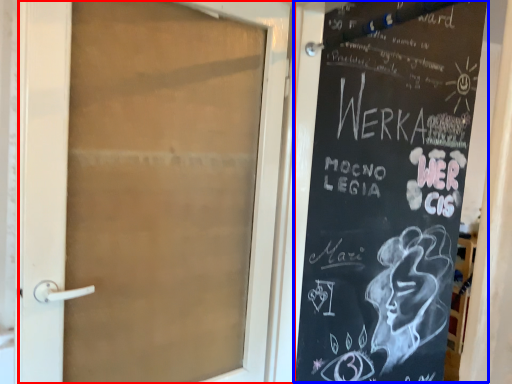
Question: Which point is further to the camera, door (highlighted by a red box) or bulletin board (highlighted by a blue box)?

Choices:
 (A) door
 (B) bulletin board

Answer: (A)